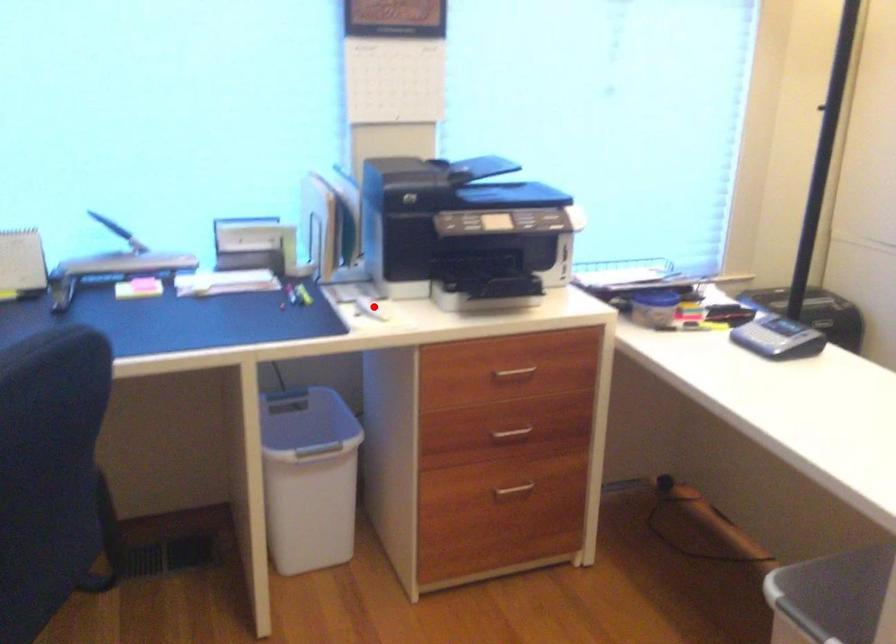
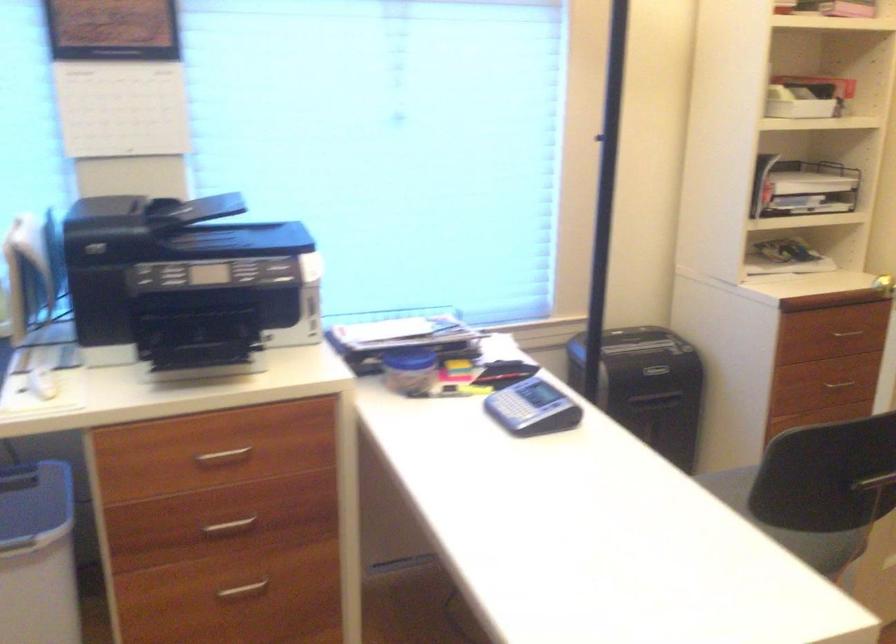
Question: I am providing you with two images of the same scene from different viewpoints. Given a red point in image1, look at the same physical point in image2. Is it:

Choices:
 (A) Closer to the viewpoint
 (B) Farther from the viewpoint

Answer: (A)